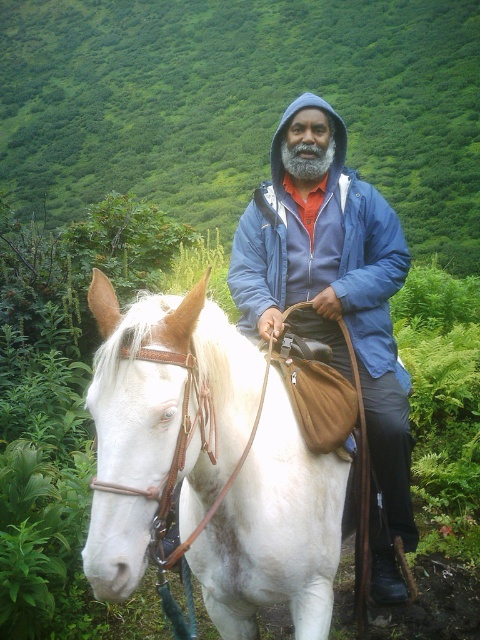
Is point (455, 51) positioned in front of point (285, 113)?

No, it is not.

Between point (434, 108) and point (371, 221), which one is positioned behind?

Point (434, 108)

What do you see at coordinates (240, 104) in the screenshot?
I see `green leafy hillside at upper center` at bounding box center [240, 104].

I want to click on green leafy hillside at upper center, so click(x=240, y=104).

Who is taller, white leather horse at center or blue fleece jacket at center?

blue fleece jacket at center is taller.

The image size is (480, 640). Find the location of `white leather horse at center`. white leather horse at center is located at coordinates (207, 465).

Does point (287, 448) come farther from viewer compared to point (386, 296)?

No, it is not.

This screenshot has height=640, width=480. Identify the location of white leather horse at center. (207, 465).

Is point (165, 52) positioned before point (231, 468)?

No, it is not.

Is the position of green leafy hillside at upper center more distant than that of white leather horse at center?

That is True.

Does point (183, 26) lie in front of point (294, 621)?

No.

Where is `green leafy hillside at upper center`? The height and width of the screenshot is (640, 480). green leafy hillside at upper center is located at coordinates (240, 104).